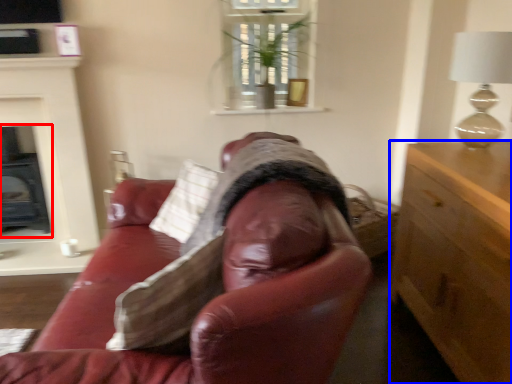
Question: Which point is closer to the camera, fireplace (highlighted by a red box) or cabinetry (highlighted by a blue box)?

Choices:
 (A) fireplace
 (B) cabinetry

Answer: (B)